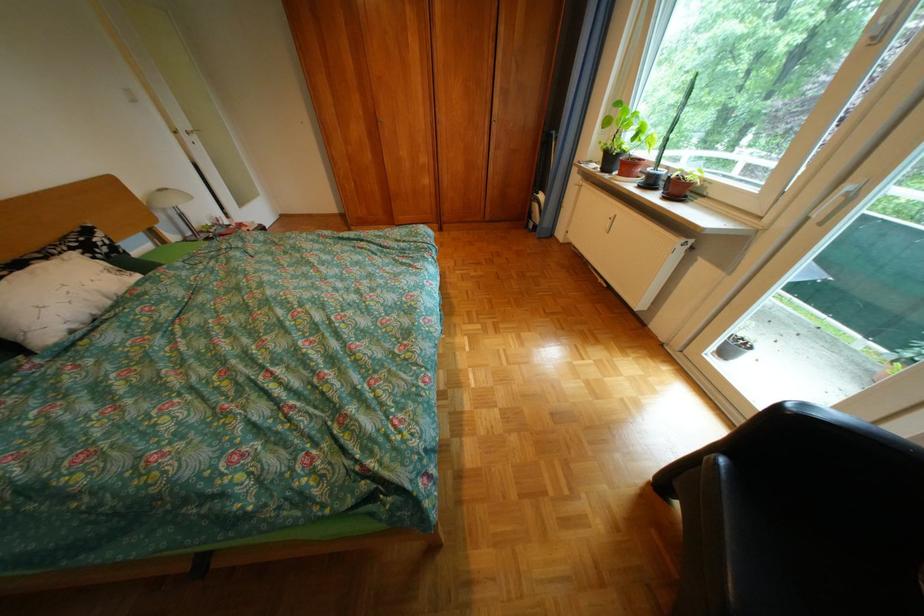
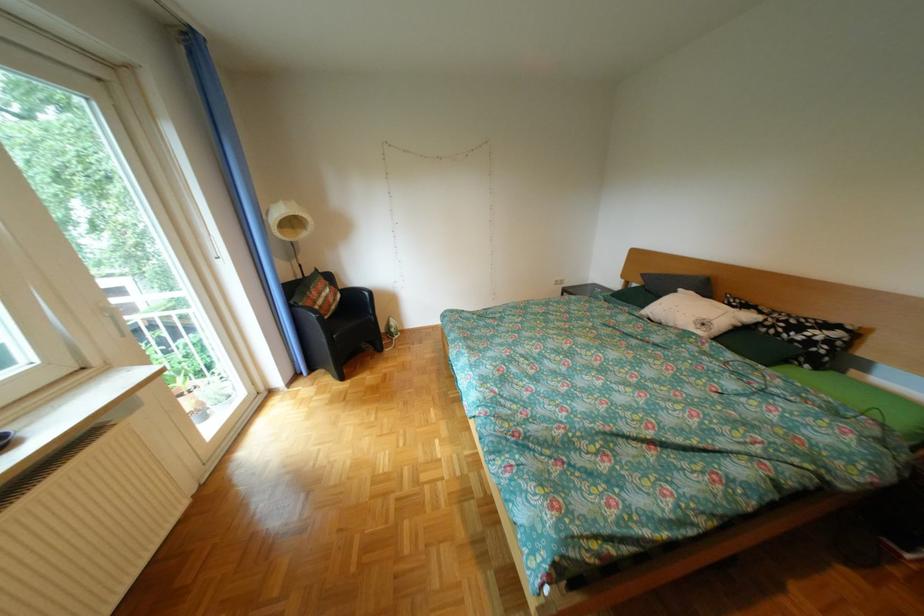
Locate, in the second image, the point that corresponds to the point at 59,259 in the first image.

(775, 313)